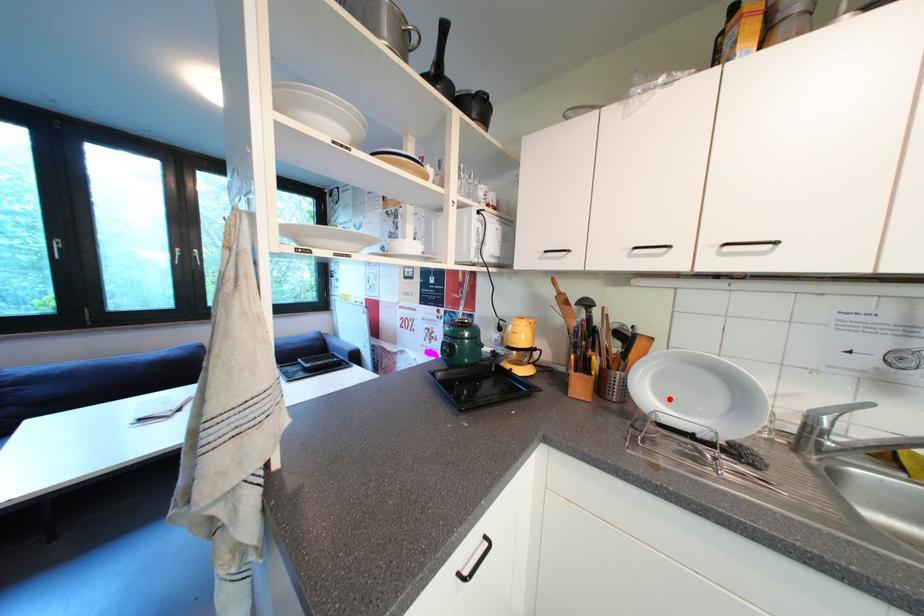
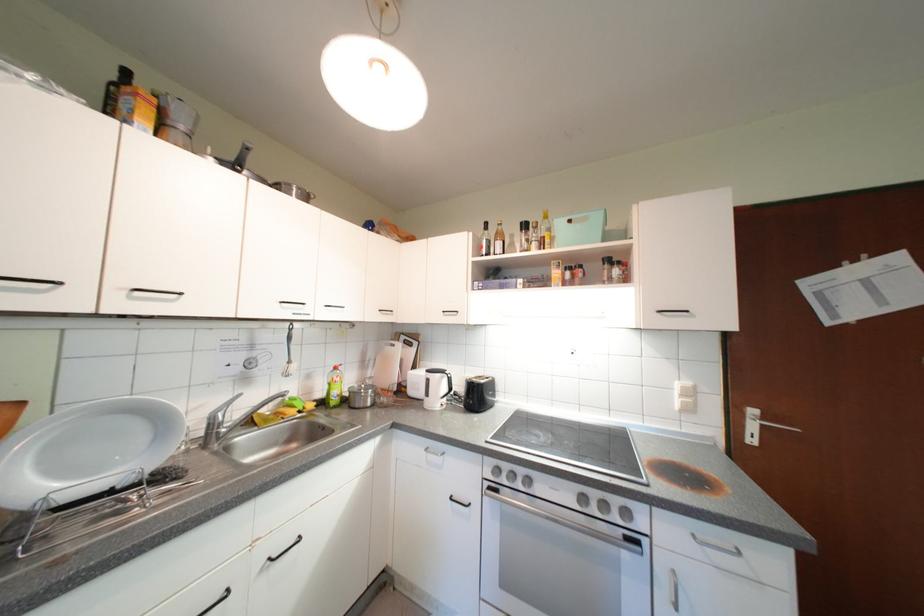
Where in the second image is the point corresponding to the highlighted location from the first image?

(64, 475)